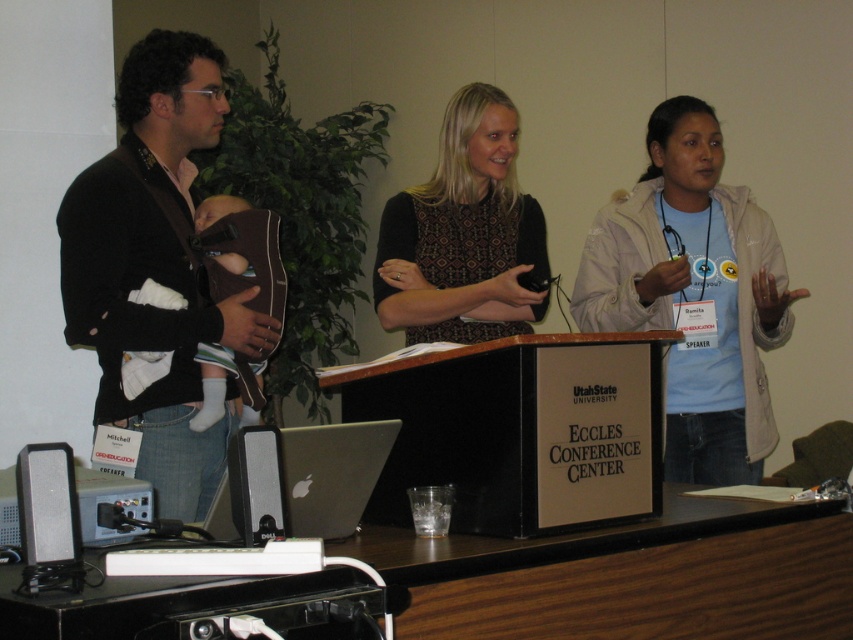
Does wooden table at lower center have a greater width compared to brown leather baby carrier at left?

Yes, wooden table at lower center is wider than brown leather baby carrier at left.

What do you see at coordinates (630, 576) in the screenshot?
I see `wooden table at lower center` at bounding box center [630, 576].

Where is `wooden table at lower center`? Image resolution: width=853 pixels, height=640 pixels. wooden table at lower center is located at coordinates (630, 576).

Is light beige jacket at center wider than black textured dress at center?

Correct, the width of light beige jacket at center exceeds that of black textured dress at center.

The height and width of the screenshot is (640, 853). What do you see at coordinates (693, 292) in the screenshot? I see `light beige jacket at center` at bounding box center [693, 292].

What are the coordinates of `light beige jacket at center` in the screenshot? It's located at (693, 292).

From the picture: Is black textured dress at center below silver metallic speaker at lower left?

Actually, black textured dress at center is above silver metallic speaker at lower left.

Identify the location of black textured dress at center. (463, 234).